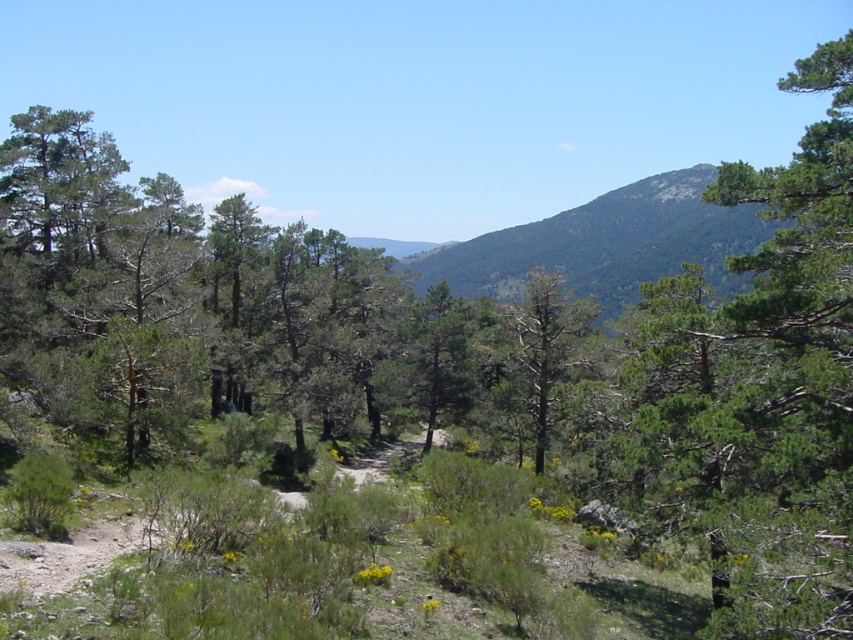
Locate an element on the screen. This screenshot has height=640, width=853. green leafy tree at upper right is located at coordinates (764, 387).

Does point (810, 193) come behind point (637, 250)?

That is False.

I want to click on green leafy tree at upper right, so click(764, 387).

Find the location of `green leafy tree at upper right`. green leafy tree at upper right is located at coordinates (764, 387).

Based on the photo, does green leafy tree at upper right appear over green textured tree at center?

Indeed, green leafy tree at upper right is positioned over green textured tree at center.

Can you confirm if green leafy tree at upper right is positioned below green textured tree at center?

Actually, green leafy tree at upper right is above green textured tree at center.

Identify the location of green leafy tree at upper right. (764, 387).

Where is `green leafy tree at upper right`? The height and width of the screenshot is (640, 853). green leafy tree at upper right is located at coordinates (764, 387).

Between point (548, 260) and point (553, 381), which one is positioned behind?

The point (548, 260) is behind.

Describe the element at coordinates (606, 243) in the screenshot. I see `green leafy hillside at center` at that location.

The height and width of the screenshot is (640, 853). Identify the location of green leafy hillside at center. (606, 243).